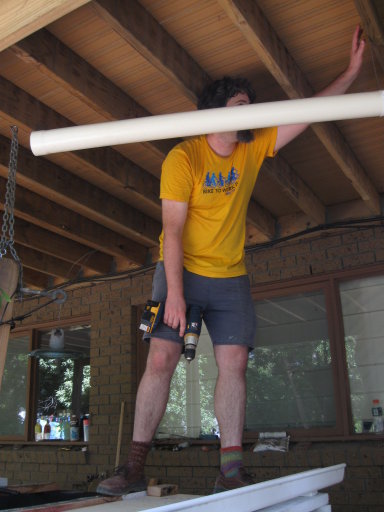
I want to click on wall, so click(x=114, y=376), click(x=337, y=248), click(x=364, y=475), click(x=87, y=303), click(x=22, y=461).